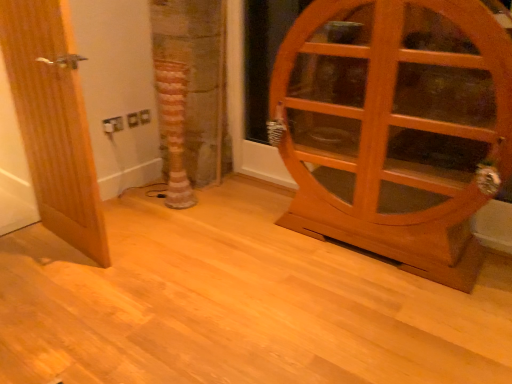
Question: In the image, is striped fabric tree trunk at center positioned in front of or behind wooden cabinet at right, placed as the second door when sorted from left to right?

Choices:
 (A) behind
 (B) front

Answer: (A)

Question: Looking at their shapes, would you say striped fabric tree trunk at center is wider or thinner than wooden cabinet at right, placed as the second door when sorted from left to right?

Choices:
 (A) wide
 (B) thin

Answer: (B)

Question: Based on their relative distances, which object is nearer to the striped fabric tree trunk at center?

Choices:
 (A) wooden door at left, which is counted as the 1th door, starting from the left
 (B) wooden cabinet at right, acting as the 1th door starting from the right

Answer: (A)

Question: Which object is the closest to the wooden door at left, which is counted as the 1th door, starting from the left?

Choices:
 (A) wooden cabinet at right, placed as the second door when sorted from left to right
 (B) striped fabric tree trunk at center

Answer: (B)